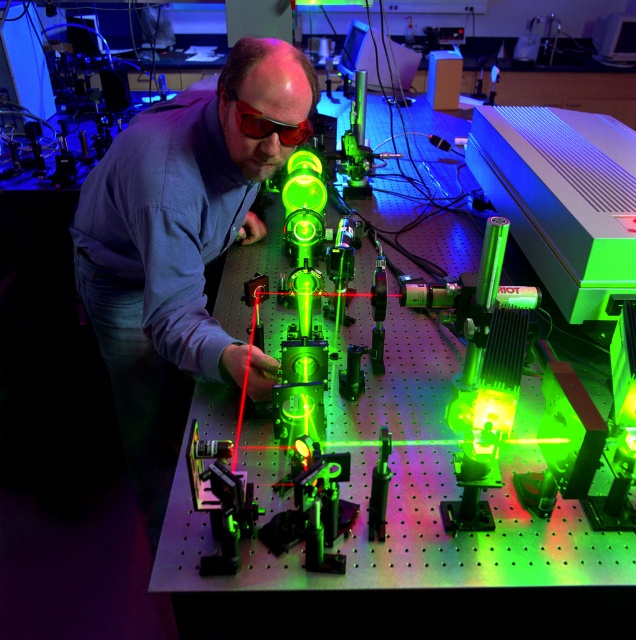
You are a researcher in the lab. You need to adjust the laser beam to hit a target located at point 1.13 meters away from the camera. Can you use the point at coordinates point (163,285) to aim the laser?

Yes, the point at coordinates point (163,285) is exactly 1.13 meters from the camera, so adjusting the laser to aim at this point will hit the target located at that distance.

You are a lab technician needing to place a 40 cm ruler between the matte black shirt at center and the red plastic glasses at center. Can the ruler fit entirely between them without overlapping either object?

The distance between the matte black shirt at center and the red plastic glasses at center is 43.88 centimeters. Since the ruler is only 40 cm long, it can fit entirely between them without overlapping either object.

You are a lab assistant who needs to locate the researcher in the lab. According to the image, where is the matte black shirt at center positioned in terms of coordinates?

The matte black shirt at center is positioned at coordinates point (177,248).